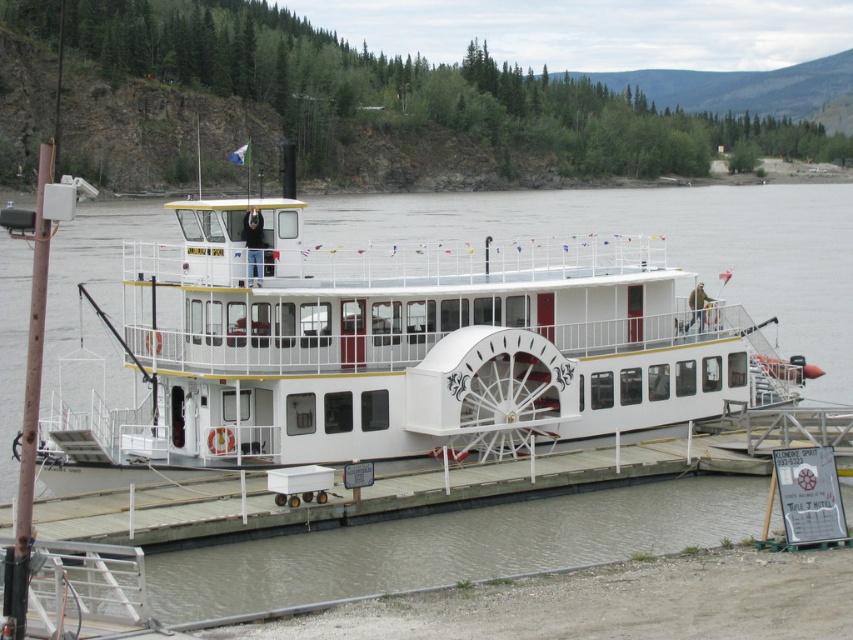
Is white matte paddlewheel boat at center to the left of white wooden dock at center from the viewer's perspective?

Yes, white matte paddlewheel boat at center is to the left of white wooden dock at center.

Between white matte paddlewheel boat at center and white wooden dock at center, which one has more height?

Standing taller between the two is white matte paddlewheel boat at center.

Locate an element on the screen. This screenshot has width=853, height=640. white matte paddlewheel boat at center is located at coordinates (399, 353).

The width and height of the screenshot is (853, 640). What are the coordinates of `white matte paddlewheel boat at center` in the screenshot? It's located at (399, 353).